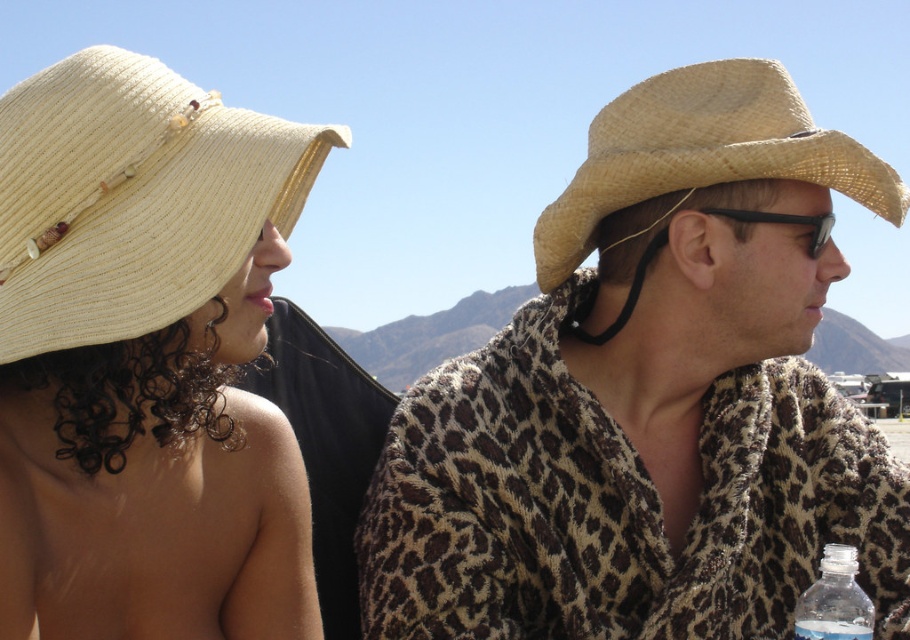
Question: Is straw hat at left wider than straw hat at right?

Choices:
 (A) yes
 (B) no

Answer: (B)

Question: Which point is farther from the camera taking this photo?

Choices:
 (A) (605, 243)
 (B) (157, 164)
 (C) (819, 236)
 (D) (826, 580)

Answer: (A)

Question: Can you confirm if leopard print towel at center is positioned above black plastic goggles at upper right?

Choices:
 (A) no
 (B) yes

Answer: (A)

Question: Among these points, which one is farthest from the camera?

Choices:
 (A) (896, 520)
 (B) (170, 264)

Answer: (A)

Question: Considering the real-world distances, which object is closest to the black plastic goggles at upper right?

Choices:
 (A) leopard print towel at center
 (B) straw hat at left
 (C) straw hat at right
 (D) clear plastic bottle at lower right

Answer: (C)

Question: Can you confirm if straw hat at left is positioned to the left of black plastic goggles at upper right?

Choices:
 (A) yes
 (B) no

Answer: (A)